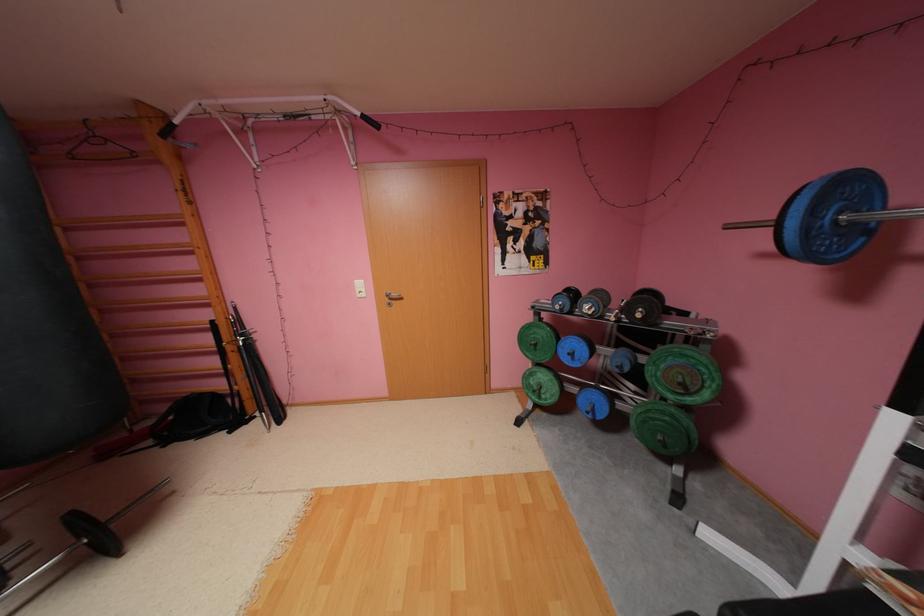
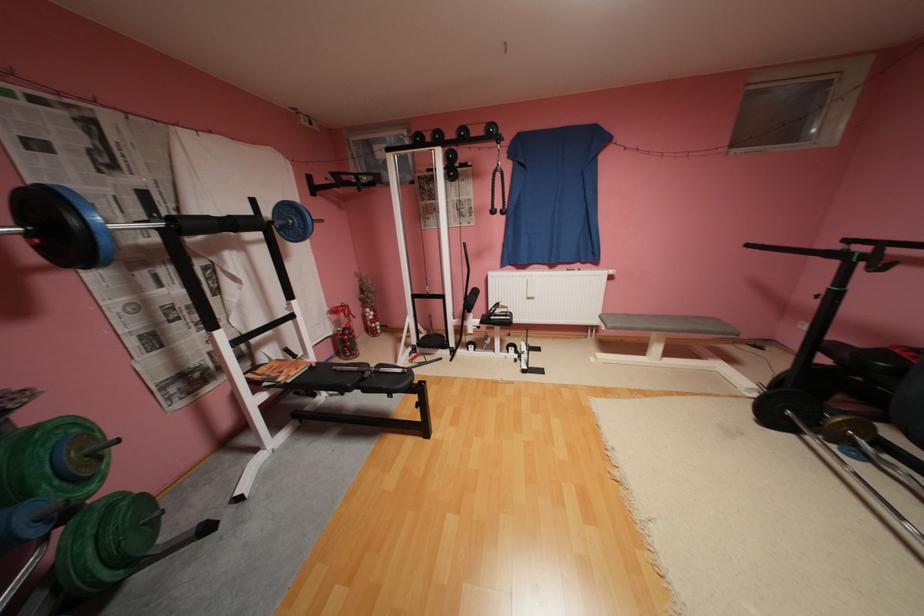
Find the pixel in the second image that matches point 698,392 in the first image.

(111, 459)